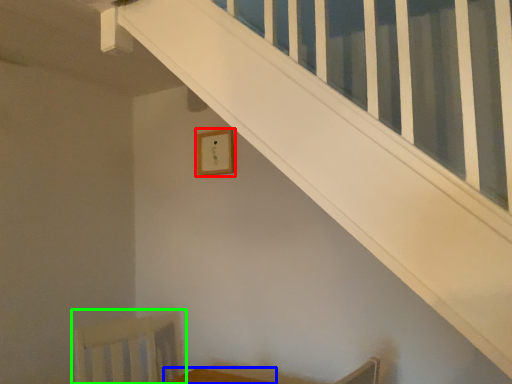
Question: Which is nearer to the picture frame (highlighted by a red box)? furniture (highlighted by a blue box) or swivel chair (highlighted by a green box).

Choices:
 (A) furniture
 (B) swivel chair

Answer: (B)